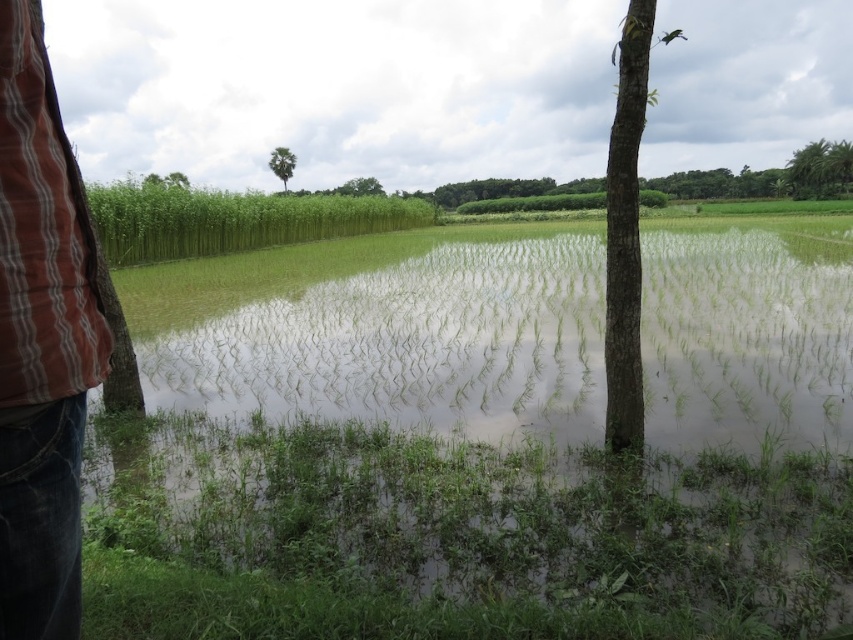
What do you see at coordinates (819, 170) in the screenshot?
I see `green leafy tree at upper right` at bounding box center [819, 170].

Between point (810, 145) and point (171, 172), which one is positioned in front?

Point (810, 145)

Between point (824, 189) and point (183, 184), which one is positioned behind?

The point (183, 184) is more distant.

This screenshot has width=853, height=640. Find the location of `green leafy tree at upper right`. green leafy tree at upper right is located at coordinates (819, 170).

Between green leafy tree at upper center and green leafy tree at upper left, which one is positioned higher?

green leafy tree at upper center is above.

Does green leafy tree at upper center appear over green leafy tree at upper left?

Indeed, green leafy tree at upper center is positioned over green leafy tree at upper left.

Which is behind, point (274, 147) or point (171, 177)?

Point (171, 177)

The width and height of the screenshot is (853, 640). In order to click on green leafy tree at upper center in this screenshot , I will do `click(282, 163)`.

Is point (57, 177) more distant than point (811, 154)?

No, (57, 177) is closer to viewer.

Does jeans at left appear over green leafy tree at upper right?

Actually, jeans at left is below green leafy tree at upper right.

Which is in front, point (15, 541) or point (817, 192)?

Point (15, 541) is more forward.

This screenshot has height=640, width=853. Identify the location of jeans at left. (41, 342).